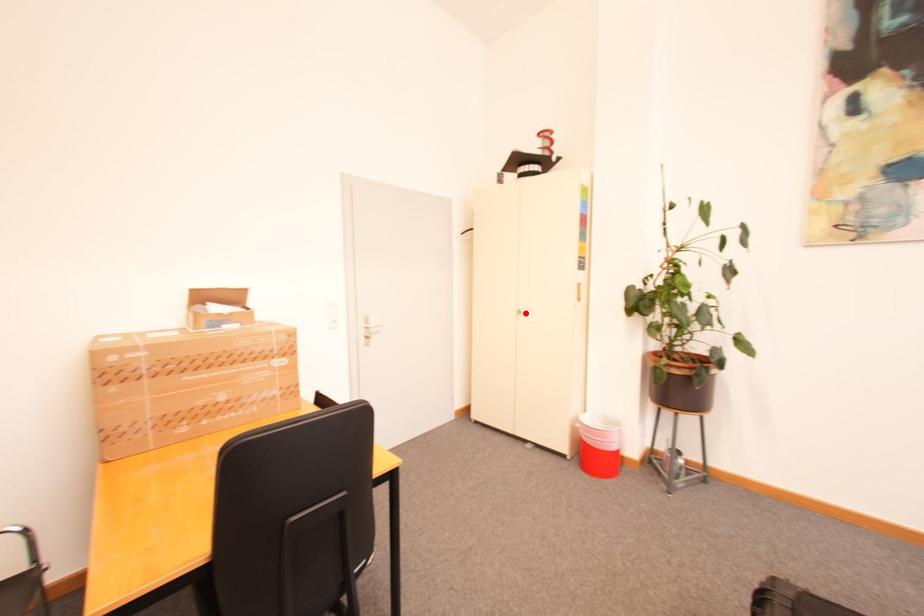
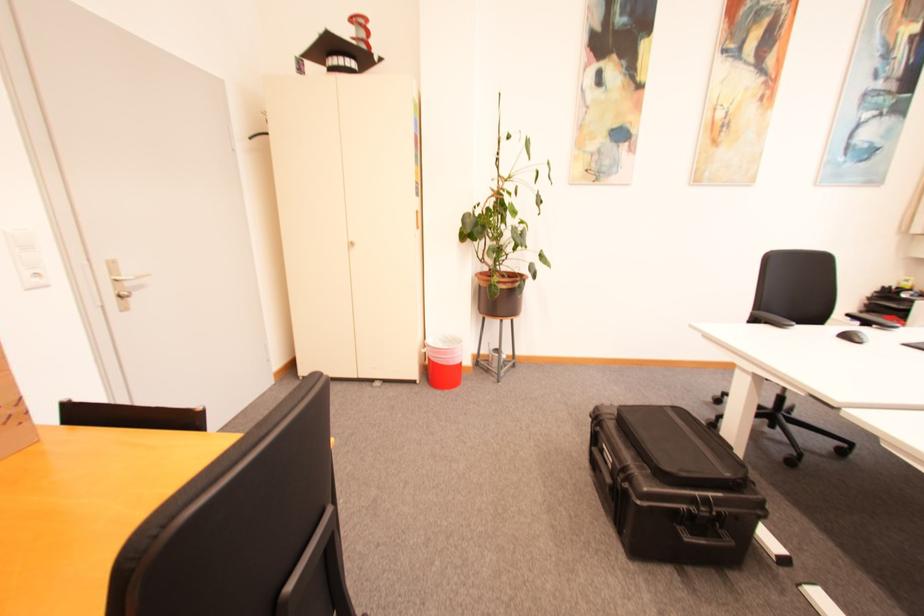
Find the pixel in the second image that matches the highlighted location in the first image.

(359, 245)